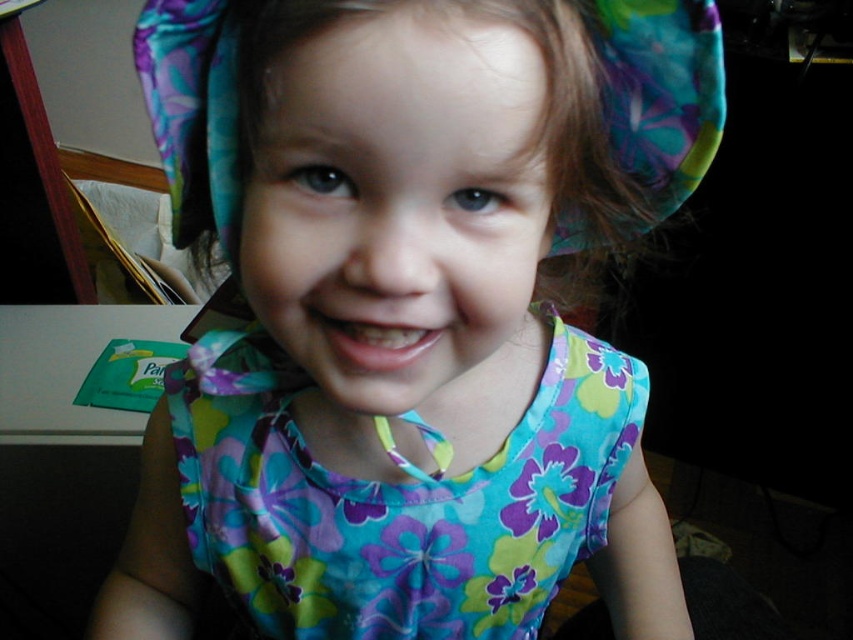
You are a fashion designer looking at this child outfit. You need to decide whether the floral fabric head at center can be seen without the floral fabric hat at upper center. Based on their positions, is this possible?

The floral fabric head at center is positioned under the floral fabric hat at upper center, so it cannot be seen without the hat.

The child is wearing a floral fabric dress at center and a floral fabric head at center. Which one is taller?

The floral fabric dress at center is taller than the floral fabric head at center.

Looking at the child in the image, which item of clothing is smaller between the floral fabric head at center and the floral cotton dress at center?

The floral fabric head at center is smaller than the floral cotton dress at center.